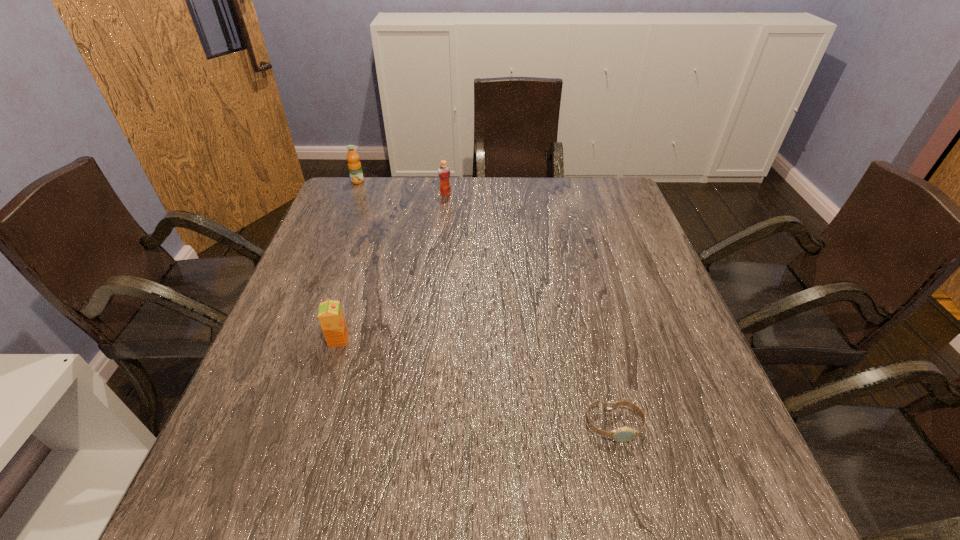
Find the location of `free spot between the third nearest object and the rightmost object`. free spot between the third nearest object and the rightmost object is located at coordinates (529, 309).

Point out which object is positioned as the nearest to the rightmost object. Please provide its 2D coordinates. Your answer should be formatted as a tuple, i.e. [(x, y)], where the tuple contains the x and y coordinates of a point satisfying the conditions above.

[(330, 315)]

Identify which object is located as the third nearest to the shortest object. Please provide its 2D coordinates. Your answer should be formatted as a tuple, i.e. [(x, y)], where the tuple contains the x and y coordinates of a point satisfying the conditions above.

[(355, 170)]

Locate an element on the screen. Image resolution: width=960 pixels, height=540 pixels. the closest orange juice to the watch is located at coordinates (330, 315).

Image resolution: width=960 pixels, height=540 pixels. Identify the location of orange juice that stands as the closest to the second object from left to right. (443, 171).

The image size is (960, 540). In order to click on vacant region that satisfies the following two spatial constraints: 1. on the label of the second orange juice from right to left; 2. on the left side of the farthest orange juice in this screenshot , I will do `click(294, 340)`.

I want to click on free spot that satisfies the following two spatial constraints: 1. on the label of the farthest object; 2. on the left side of the second orange juice from left to right, so click(294, 340).

This screenshot has width=960, height=540. I want to click on free space that satisfies the following two spatial constraints: 1. on the label of the farthest object; 2. on the right side of the second farthest object, so click(352, 194).